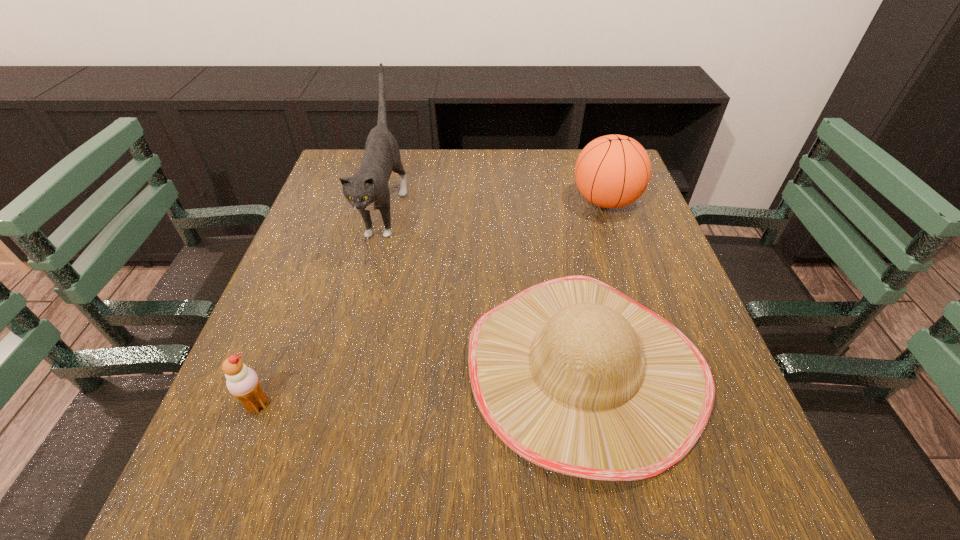
The image size is (960, 540). In the image, there is a desktop. What are the coordinates of `free space at the left edge` in the screenshot? It's located at (327, 282).

In the image, there is a desktop. Identify the location of free region at the right edge. (674, 276).

Locate an element on the screen. free space at the near right corner is located at coordinates (x=709, y=475).

Identify the location of blank region between the second object from left to right and the sunhat. Image resolution: width=960 pixels, height=540 pixels. (485, 288).

At what (x,y) coordinates should I click in order to perform the action: click on empty space between the leftmost object and the tallest object. Please return your answer as a coordinate pair (x, y). Looking at the image, I should click on (322, 306).

Find the location of a particular element. This screenshot has width=960, height=540. empty space that is in between the cat and the icecream is located at coordinates [322, 306].

Where is `free spot between the third shortest object and the icecream`? The width and height of the screenshot is (960, 540). free spot between the third shortest object and the icecream is located at coordinates (432, 303).

The image size is (960, 540). In order to click on empty space that is in between the icecream and the tallest object in this screenshot , I will do `click(322, 306)`.

Where is `vacant space in between the leftmost object and the sunhat`? This screenshot has height=540, width=960. vacant space in between the leftmost object and the sunhat is located at coordinates (420, 386).

Find the location of a particular element. free spot between the sunhat and the leftmost object is located at coordinates click(x=420, y=386).